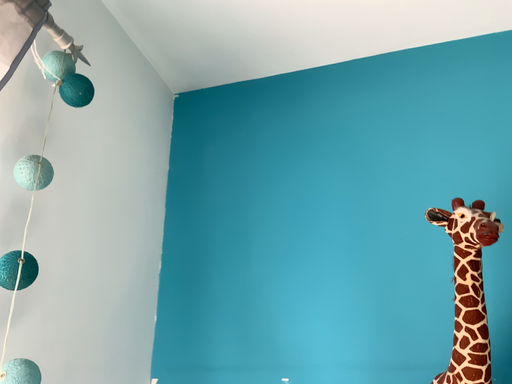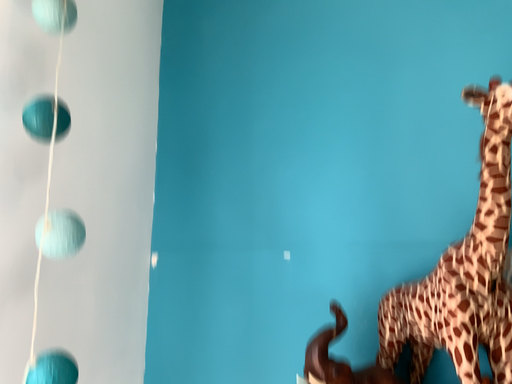
Question: Which way did the camera rotate in the video?

Choices:
 (A) rotated upward
 (B) rotated downward

Answer: (B)